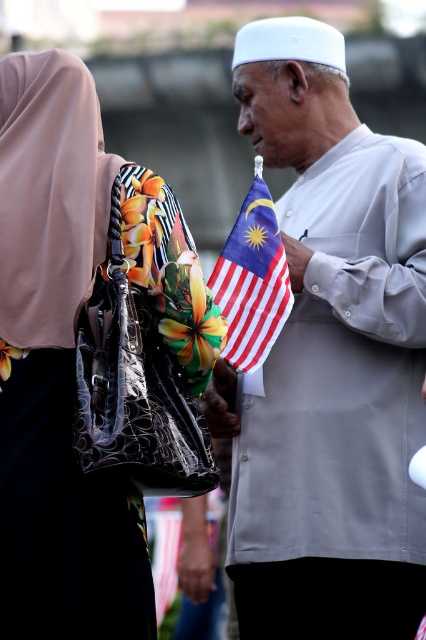
This screenshot has width=426, height=640. Find the location of `light gray cotton shirt at center`. light gray cotton shirt at center is located at coordinates (328, 362).

Image resolution: width=426 pixels, height=640 pixels. Describe the element at coordinates (328, 362) in the screenshot. I see `light gray cotton shirt at center` at that location.

Does point (281, 129) come closer to viewer compared to point (129, 204)?

No, it is not.

Find the location of a particular element. The height and width of the screenshot is (640, 426). light gray cotton shirt at center is located at coordinates (328, 362).

Can you confirm if light gray cotton shirt at center is positioned above polyester malaysian flag at center?

No.

Who is more forward, (386, 209) or (236, 337)?

Point (236, 337) is more forward.

Locate an element on the screen. The width and height of the screenshot is (426, 640). light gray cotton shirt at center is located at coordinates (328, 362).

From the picture: Is light gray cotton shirt at center in front of leather handbag at center?

No, light gray cotton shirt at center is behind leather handbag at center.

Does light gray cotton shirt at center appear over leather handbag at center?

Yes.

Is point (325, 490) closer to camera compared to point (100, 218)?

No, it is behind (100, 218).

In order to click on light gray cotton shirt at center in this screenshot , I will do `click(328, 362)`.